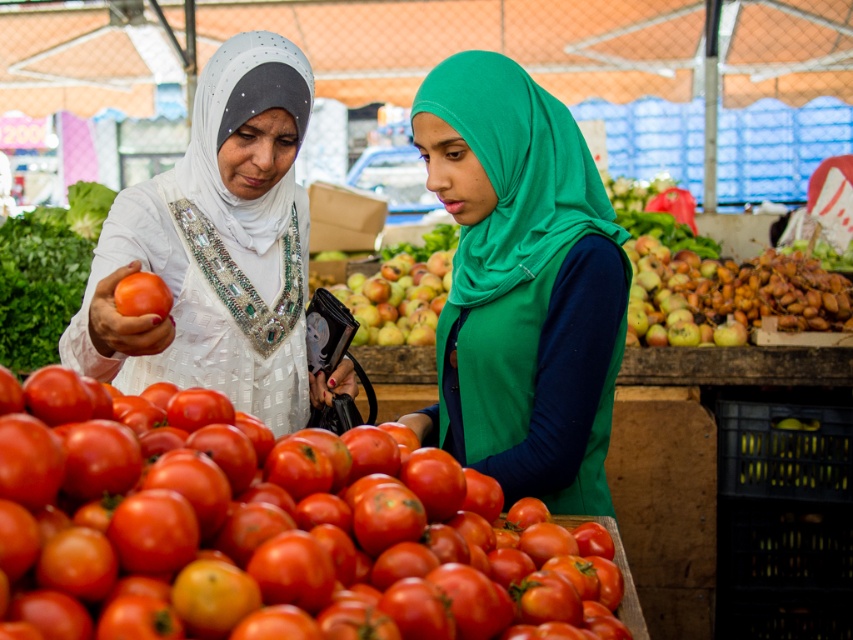
Does brown textured nuts at right appear under white satin hijab at upper left?

Indeed, brown textured nuts at right is positioned under white satin hijab at upper left.

Which of these two, brown textured nuts at right or white satin hijab at upper left, stands shorter?

brown textured nuts at right

Is point (643, 276) positioned before point (283, 70)?

That is False.

Image resolution: width=853 pixels, height=640 pixels. I want to click on brown textured nuts at right, so click(747, 296).

Consider the image. Is shiny red tomato at center above red matte tomato at left?

Incorrect, shiny red tomato at center is not positioned above red matte tomato at left.

Is the position of shiny red tomato at center more distant than that of red matte tomato at left?

That is False.

Does point (328, 596) come closer to viewer compared to point (160, 288)?

That is True.

This screenshot has width=853, height=640. I want to click on shiny red tomato at center, so click(x=267, y=534).

Does point (57, 556) come farther from viewer compared to point (207, 202)?

No, (57, 556) is closer to viewer.

At what (x,y) coordinates should I click in order to perform the action: click on shiny red tomato at center. Please return your answer as a coordinate pair (x, y). The image size is (853, 640). Looking at the image, I should click on (267, 534).

Is point (572, 586) closer to camera compared to point (247, 225)?

Yes, point (572, 586) is closer to viewer.

Image resolution: width=853 pixels, height=640 pixels. Identify the location of shiny red tomato at center. (267, 534).